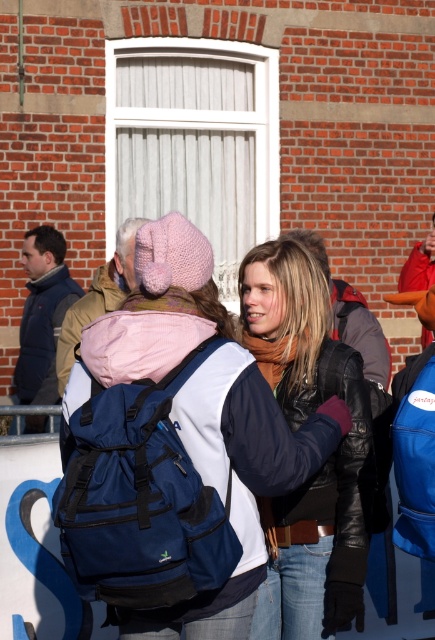
Can you confirm if matte black jacket at center is bigger than matte black jacket at left?

Actually, matte black jacket at center might be smaller than matte black jacket at left.

Which of these two, matte black jacket at center or matte black jacket at left, stands shorter?

matte black jacket at left is shorter.

Who is more forward, [333,506] or [46,381]?

Point [333,506] is in front.

Locate an element on the screen. The height and width of the screenshot is (640, 435). matte black jacket at center is located at coordinates (327, 458).